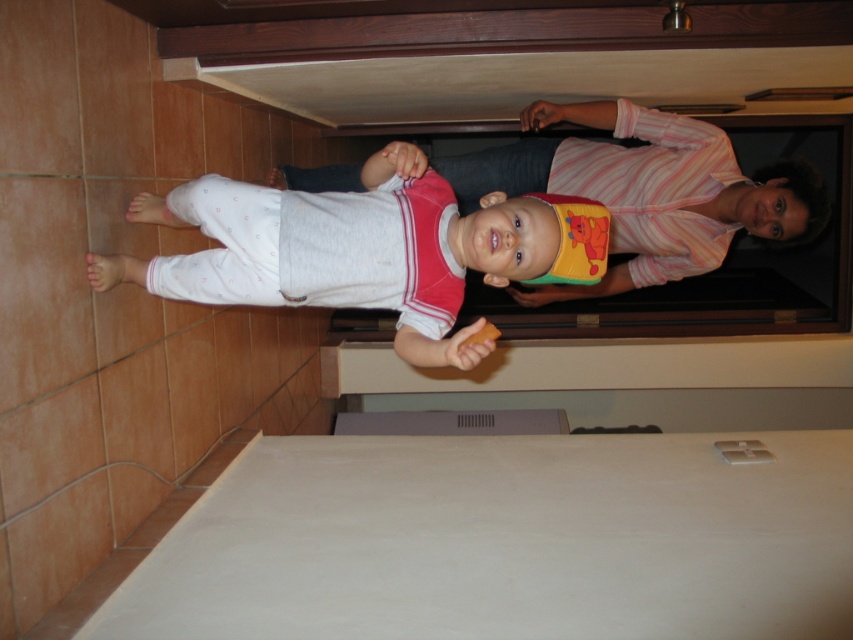
Based on the photo, which of these two, white soft baby at center or white cotton bib at center, stands taller?

white cotton bib at center is taller.

Identify the location of white soft baby at center. (323, 244).

The height and width of the screenshot is (640, 853). Find the location of `white soft baby at center`. white soft baby at center is located at coordinates (323, 244).